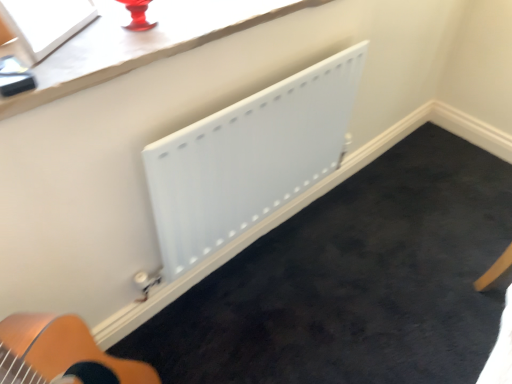
What do you see at coordinates (46, 22) in the screenshot?
I see `white glossy window screen at upper left` at bounding box center [46, 22].

The image size is (512, 384). Find the location of `white glossy window screen at upper left`. white glossy window screen at upper left is located at coordinates (46, 22).

Locate an element on the screen. white matte radiator at center is located at coordinates (249, 159).

The image size is (512, 384). What do you see at coordinates (249, 159) in the screenshot?
I see `white matte radiator at center` at bounding box center [249, 159].

Locate an element on the screen. white glossy window screen at upper left is located at coordinates (46, 22).

Is white matte radiator at center at the right side of white glossy window screen at upper left?

Yes.

Is white matte radiator at center behind white glossy window screen at upper left?

Yes, the depth of white matte radiator at center is greater than that of white glossy window screen at upper left.

Is point (258, 173) behind point (28, 13)?

Yes, it is behind point (28, 13).

From the image's perspective, is white matte radiator at center located above or below white glossy window screen at upper left?

From the image's perspective, white matte radiator at center appears below white glossy window screen at upper left.

From a real-world perspective, is white matte radiator at center physically located above or below white glossy window screen at upper left?

white matte radiator at center is situated lower than white glossy window screen at upper left in the real world.

Which of these two, white matte radiator at center or white glossy window screen at upper left, is thinner?

white matte radiator at center.

Can you confirm if white matte radiator at center is shorter than white glossy window screen at upper left?

No.

Looking at this image, which of these two, white matte radiator at center or white glossy window screen at upper left, is smaller?

Smaller between the two is white glossy window screen at upper left.

Looking at this image, is white matte radiator at center positioned beyond the bounds of white glossy window screen at upper left?

Yes, white matte radiator at center is outside of white glossy window screen at upper left.

Looking at this image, is the surface of white matte radiator at center in direct contact with white glossy window screen at upper left?

No, white matte radiator at center is not beside white glossy window screen at upper left.

Is white matte radiator at center turned away from white glossy window screen at upper left?

No, white matte radiator at center is not facing the opposite direction of white glossy window screen at upper left.

How far apart are white matte radiator at center and white glossy window screen at upper left?

The distance of white matte radiator at center from white glossy window screen at upper left is 21.12 inches.

Locate an element on the screen. radiator below the white glossy window screen at upper left (from a real-world perspective) is located at coordinates (249, 159).

Can you confirm if white glossy window screen at upper left is positioned to the right of white matte radiator at center?

Incorrect, white glossy window screen at upper left is not on the right side of white matte radiator at center.

In the image, is white glossy window screen at upper left positioned in front of or behind white matte radiator at center?

In the image, white glossy window screen at upper left appears in front of white matte radiator at center.

Is point (73, 11) positioned in front of point (221, 141)?

Yes, point (73, 11) is closer to viewer.

From the image's perspective, is white glossy window screen at upper left over white matte radiator at center?

Yes, from the image's perspective, white glossy window screen at upper left is over white matte radiator at center.

From a real-world perspective, is white glossy window screen at upper left above or below white matte radiator at center?

white glossy window screen at upper left is above white matte radiator at center.

Considering the relative sizes of white glossy window screen at upper left and white matte radiator at center in the image provided, is white glossy window screen at upper left wider than white matte radiator at center?

Correct, the width of white glossy window screen at upper left exceeds that of white matte radiator at center.

Considering the relative sizes of white glossy window screen at upper left and white matte radiator at center in the image provided, is white glossy window screen at upper left shorter than white matte radiator at center?

Indeed, white glossy window screen at upper left has a lesser height compared to white matte radiator at center.

Which of these two, white glossy window screen at upper left or white matte radiator at center, is bigger?

white matte radiator at center is bigger.

Does white glossy window screen at upper left contain white matte radiator at center?

No, white matte radiator at center is located outside of white glossy window screen at upper left.

Is white glossy window screen at upper left touching white matte radiator at center?

white glossy window screen at upper left is not next to white matte radiator at center, and they're not touching.

Could you tell me if white glossy window screen at upper left is facing white matte radiator at center?

No, white glossy window screen at upper left does not turn towards white matte radiator at center.

How much distance is there between white glossy window screen at upper left and white matte radiator at center?

white glossy window screen at upper left and white matte radiator at center are 53.64 centimeters apart from each other.

Locate an element on the screen. The image size is (512, 384). window screen on the left of white matte radiator at center is located at coordinates (46, 22).

In order to click on radiator on the right of the white glossy window screen at upper left in this screenshot , I will do `click(249, 159)`.

This screenshot has width=512, height=384. In order to click on window screen above the white matte radiator at center (from the image's perspective) in this screenshot , I will do `click(46, 22)`.